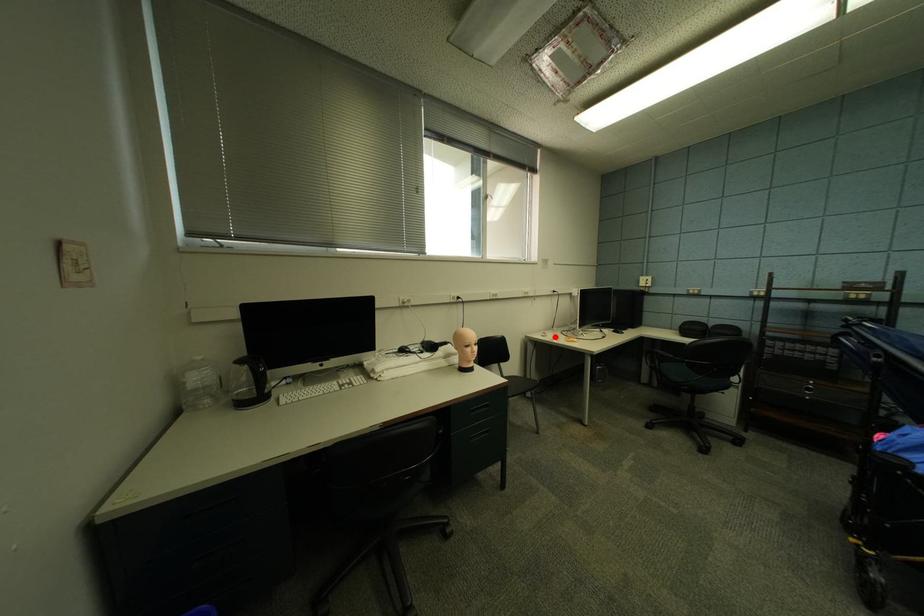
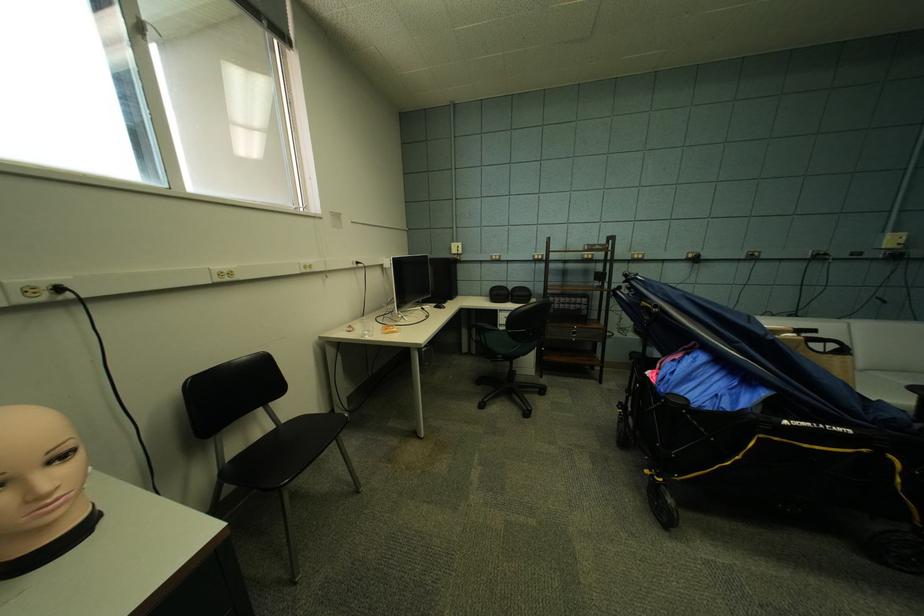
Find the pixel in the second image that matches the highlighted location in the first image.

(361, 331)